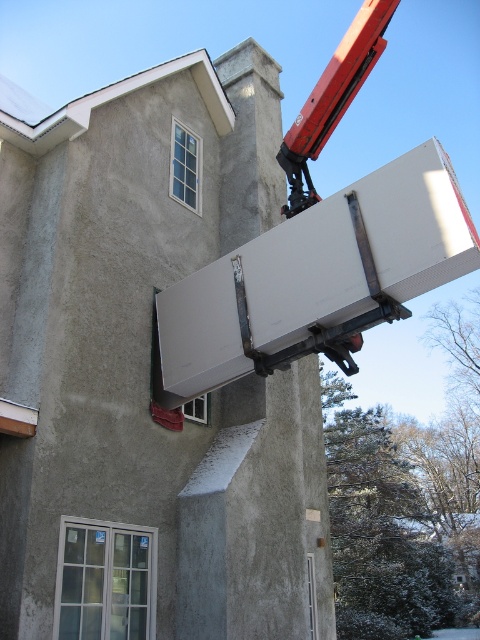
Who is more forward, (333, 198) or (368, 68)?

Point (333, 198)

The width and height of the screenshot is (480, 640). Find the location of `white matte refrigerator at upper center`. white matte refrigerator at upper center is located at coordinates (316, 275).

Is point (265, 298) farther from viewer compared to point (299, 172)?

No, it is not.

At what (x,y) coordinates should I click in order to perform the action: click on white matte refrigerator at upper center. Please return your answer as a coordinate pair (x, y). Image resolution: width=480 pixels, height=640 pixels. Looking at the image, I should click on (316, 275).